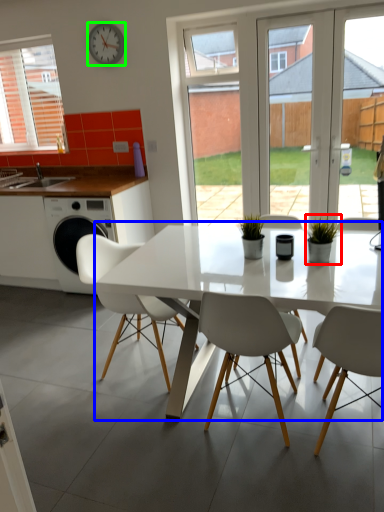
Question: Estimate the real-world distances between objects in this image. Which object is farther from houseplant (highlighted by a red box), kitchen & dining room table (highlighted by a blue box) or clock (highlighted by a green box)?

Choices:
 (A) kitchen & dining room table
 (B) clock

Answer: (B)